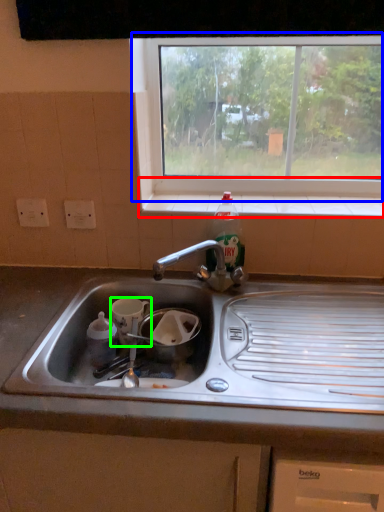
Question: Which object is the closest to the window sill (highlighted by a red box)? Choose among these: window (highlighted by a blue box) or appliance (highlighted by a green box).

Choices:
 (A) window
 (B) appliance

Answer: (A)